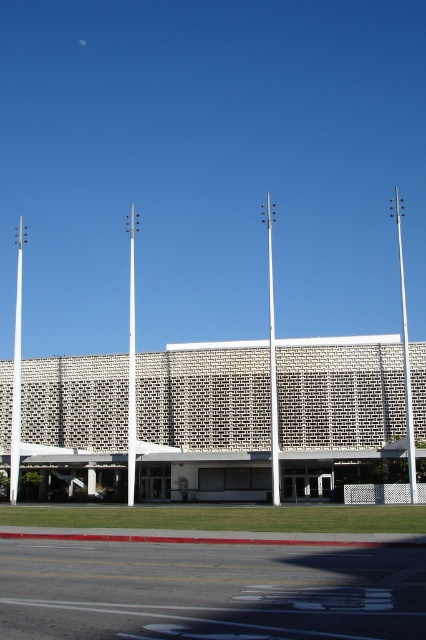
Question: Which point is farther to the camera?

Choices:
 (A) (20, 280)
 (B) (132, 269)

Answer: (A)

Question: Which point appears closest to the camera in this image?

Choices:
 (A) (20, 342)
 (B) (129, 323)
 (C) (414, 486)

Answer: (C)

Question: Is white smooth pole at center closer to camera compared to silver metallic pole at right?

Choices:
 (A) yes
 (B) no

Answer: (B)

Question: From the image, what is the correct spatial relationship of white metallic pole at center in relation to silver metallic pole at right?

Choices:
 (A) right
 (B) left

Answer: (B)

Question: Observing the image, what is the correct spatial positioning of white smooth pole at left in reference to silver metallic pole at right?

Choices:
 (A) below
 (B) above

Answer: (A)

Question: Among these objects, which one is nearest to the camera?

Choices:
 (A) white smooth pole at left
 (B) white smooth pole at center
 (C) silver metallic pole at right

Answer: (C)